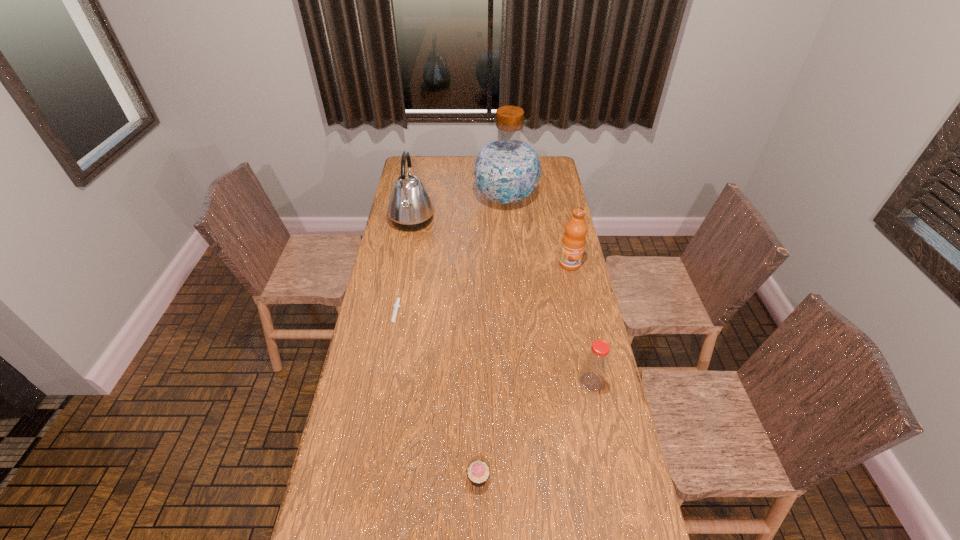
Locate an element on the screen. This screenshot has width=960, height=540. vacant area in the image that satisfies the following two spatial constraints: 1. from the spout of the nearest object; 2. on the right side of the second tallest object is located at coordinates (365, 478).